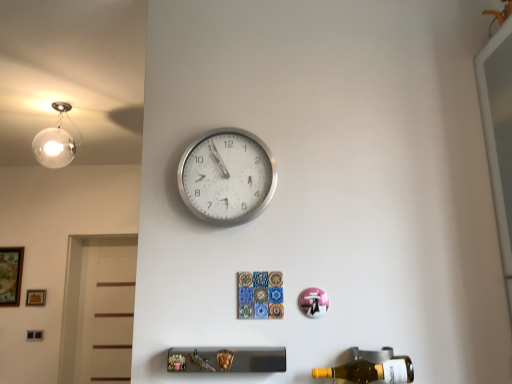
Question: Is wooden picture frame at lower left, which is the 2th picture frame from left to right, situated inside wooden framed artwork at left, the first picture frame from the left, or outside?

Choices:
 (A) inside
 (B) outside

Answer: (B)

Question: In the image, is wooden picture frame at lower left, which is the 2th picture frame from left to right, on the left side or the right side of wooden framed artwork at left, the first picture frame from the left?

Choices:
 (A) left
 (B) right

Answer: (B)

Question: Based on their relative distances, which object is farther from the wooden framed artwork at left, which ranks as the 2th picture frame in right-to-left order?

Choices:
 (A) yellow glass bottle at lower right
 (B) silver metallic wall clock at upper center
 (C) wooden picture frame at lower left, which is the 2th picture frame from left to right

Answer: (A)

Question: Which is nearer to the wooden picture frame at lower left, which is the 2th picture frame from left to right?

Choices:
 (A) wooden framed artwork at left, which ranks as the 2th picture frame in right-to-left order
 (B) yellow glass bottle at lower right
 (C) silver metallic wall clock at upper center

Answer: (A)